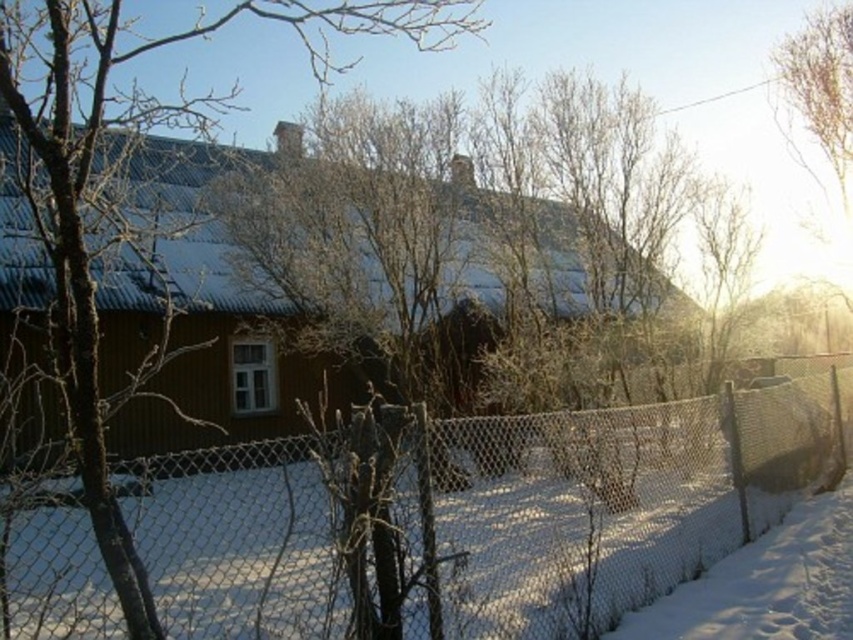
You are a delivery person trying to deliver a package to the wooden house. You need to walk from the wire mesh fence at center to the brown wood tree at center first before reaching the house. Can you walk straight through the space between them without detouring?

The wire mesh fence at center and brown wood tree at center are 5.39 meters apart from each other, so yes, you can walk straight through the space between them without detouring since the distance is sufficient for a person to pass through.

You are standing in front of the wooden house and want to walk towards the brown wood tree at center. Which direction should you move relative to the wire mesh fence at center?

To reach the brown wood tree at center, you should move to the left of the wire mesh fence at center since the tree is positioned to the left of the fence.